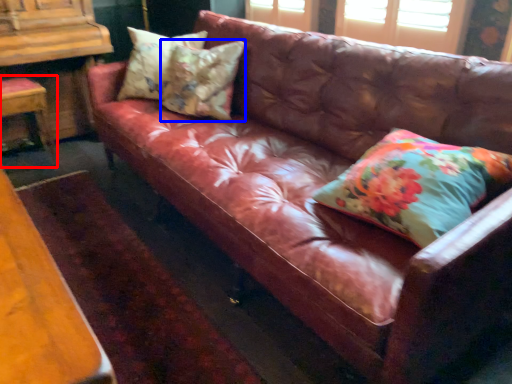
Question: Among these objects, which one is nearest to the camera, chair (highlighted by a red box) or pillow (highlighted by a blue box)?

Choices:
 (A) chair
 (B) pillow

Answer: (B)